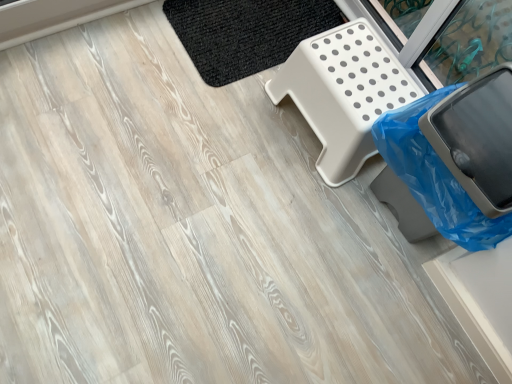
The width and height of the screenshot is (512, 384). Find the location of `white plastic step stool at upper right`. white plastic step stool at upper right is located at coordinates (343, 93).

Locate an element on the screen. black woven mat at upper center is located at coordinates point(246,33).

What are the coordinates of `white plastic step stool at upper right` in the screenshot? It's located at (343, 93).

Locate an element on the screen. furniture on the left of blue plastic trash can at lower right is located at coordinates (343, 93).

From the image's perspective, would you say blue plastic trash can at lower right is shown under white plastic step stool at upper right?

Indeed, from the image's perspective, blue plastic trash can at lower right is shown beneath white plastic step stool at upper right.

Is blue plastic trash can at lower right closer to camera compared to white plastic step stool at upper right?

Yes, blue plastic trash can at lower right is in front of white plastic step stool at upper right.

Which object is further away from the camera taking this photo, white plastic step stool at upper right or blue plastic trash can at lower right?

white plastic step stool at upper right is behind.

Is white plastic step stool at upper right not near blue plastic trash can at lower right?

They are positioned close to each other.

Considering the relative positions of white plastic step stool at upper right and blue plastic trash can at lower right in the image provided, is white plastic step stool at upper right to the right of blue plastic trash can at lower right from the viewer's perspective?

In fact, white plastic step stool at upper right is to the left of blue plastic trash can at lower right.

How far apart are white plastic step stool at upper right and blue plastic trash can at lower right?

A distance of 9.02 inches exists between white plastic step stool at upper right and blue plastic trash can at lower right.

From a real-world perspective, which is physically above, blue plastic trash can at lower right or black woven mat at upper center?

blue plastic trash can at lower right.

Would you say blue plastic trash can at lower right is outside black woven mat at upper center?

blue plastic trash can at lower right is positioned outside black woven mat at upper center.

From the image's perspective, who appears lower, blue plastic trash can at lower right or black woven mat at upper center?

blue plastic trash can at lower right.

Between blue plastic trash can at lower right and black woven mat at upper center, which one has more height?

Standing taller between the two is blue plastic trash can at lower right.

Can you confirm if black woven mat at upper center is smaller than white plastic step stool at upper right?

Yes.

Is black woven mat at upper center looking in the opposite direction of white plastic step stool at upper right?

No.

From the image's perspective, who appears lower, black woven mat at upper center or white plastic step stool at upper right?

white plastic step stool at upper right.

Is black woven mat at upper center to the left of white plastic step stool at upper right from the viewer's perspective?

Yes, black woven mat at upper center is to the left of white plastic step stool at upper right.

Based on the photo, is white plastic step stool at upper right situated inside black woven mat at upper center or outside?

white plastic step stool at upper right exists outside the volume of black woven mat at upper center.

Between white plastic step stool at upper right and black woven mat at upper center, which one has smaller size?

black woven mat at upper center.

Based on the photo, considering the relative positions of white plastic step stool at upper right and black woven mat at upper center in the image provided, is white plastic step stool at upper right behind black woven mat at upper center?

No, white plastic step stool at upper right is closer to the camera.

Is white plastic step stool at upper right aimed at black woven mat at upper center?

No, white plastic step stool at upper right is not aimed at black woven mat at upper center.

Considering the relative sizes of black woven mat at upper center and blue plastic trash can at lower right in the image provided, is black woven mat at upper center bigger than blue plastic trash can at lower right?

No.

Could you tell me if black woven mat at upper center is turned towards blue plastic trash can at lower right?

Yes, black woven mat at upper center is oriented towards blue plastic trash can at lower right.

Is black woven mat at upper center taller than blue plastic trash can at lower right?

No, black woven mat at upper center is not taller than blue plastic trash can at lower right.

Would you say black woven mat at upper center is a long distance from blue plastic trash can at lower right?

No, black woven mat at upper center is in close proximity to blue plastic trash can at lower right.

Identify the location of garbage located on the right of white plastic step stool at upper right. (457, 157).

Locate an element on the screen. furniture located underneath the blue plastic trash can at lower right (from a real-world perspective) is located at coordinates (343, 93).

Looking at this image, when comparing their distances from black woven mat at upper center, does white plastic step stool at upper right or blue plastic trash can at lower right seem further?

blue plastic trash can at lower right.

When comparing their distances from black woven mat at upper center, does blue plastic trash can at lower right or white plastic step stool at upper right seem further?

blue plastic trash can at lower right.

Based on their spatial positions, is black woven mat at upper center or blue plastic trash can at lower right further from white plastic step stool at upper right?

black woven mat at upper center lies further to white plastic step stool at upper right than the other object.

Based on their spatial positions, is white plastic step stool at upper right or black woven mat at upper center closer to blue plastic trash can at lower right?

white plastic step stool at upper right is closer to blue plastic trash can at lower right.

Considering their positions, is blue plastic trash can at lower right positioned further to white plastic step stool at upper right than black woven mat at upper center?

black woven mat at upper center is positioned further to the anchor white plastic step stool at upper right.

When comparing their distances from blue plastic trash can at lower right, does black woven mat at upper center or white plastic step stool at upper right seem closer?

white plastic step stool at upper right is positioned closer to the anchor blue plastic trash can at lower right.

Identify the location of furniture between blue plastic trash can at lower right and black woven mat at upper center along the z-axis. (343, 93).